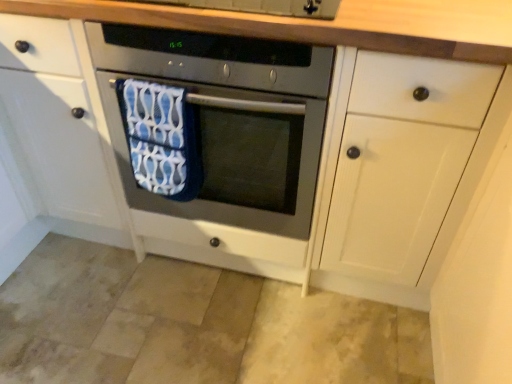
At what (x,y) coordinates should I click in order to perform the action: click on blue fabric beach towel at center. Please return your answer as a coordinate pair (x, y). This screenshot has width=512, height=384. Looking at the image, I should click on (162, 138).

What do you see at coordinates (162, 138) in the screenshot? I see `blue fabric beach towel at center` at bounding box center [162, 138].

Identify the location of satin silver oven at center. This screenshot has height=384, width=512. (226, 120).

Measure the distance between satin silver oven at center and camera.

satin silver oven at center and camera are 36.29 inches apart.

In order to face satin silver oven at center, should I rotate leftwards or rightwards?

Rotate left and turn 2.838 degrees.

Image resolution: width=512 pixels, height=384 pixels. What do you see at coordinates (226, 120) in the screenshot?
I see `satin silver oven at center` at bounding box center [226, 120].

Where is `blue fabric beach towel at center`? blue fabric beach towel at center is located at coordinates (162, 138).

Which is more to the left, blue fabric beach towel at center or satin silver oven at center?

blue fabric beach towel at center.

Consider the image. Who is more distant, blue fabric beach towel at center or satin silver oven at center?

blue fabric beach towel at center is further from the camera.

Which point is more forward, (165, 135) or (312, 81)?

Positioned in front is point (312, 81).

From the image's perspective, between blue fabric beach towel at center and satin silver oven at center, who is located below?

blue fabric beach towel at center is shown below in the image.

From a real-world perspective, which object stands above the other?

blue fabric beach towel at center, from a real-world perspective.

Can you confirm if blue fabric beach towel at center is wider than satin silver oven at center?

No.

Which of these two, blue fabric beach towel at center or satin silver oven at center, stands taller?

With more height is satin silver oven at center.

Between blue fabric beach towel at center and satin silver oven at center, which one has smaller size?

blue fabric beach towel at center.

Is blue fabric beach towel at center located outside satin silver oven at center?

Actually, blue fabric beach towel at center is within satin silver oven at center.

Consider the image. Are blue fabric beach towel at center and satin silver oven at center far apart?

They are positioned close to each other.

Could you tell me if blue fabric beach towel at center is turned towards satin silver oven at center?

Yes, blue fabric beach towel at center is aimed at satin silver oven at center.

How many degrees apart are the facing directions of blue fabric beach towel at center and satin silver oven at center?

The facing directions of blue fabric beach towel at center and satin silver oven at center are 3.1 degrees apart.

The image size is (512, 384). In order to click on oven on the right of blue fabric beach towel at center in this screenshot , I will do `click(226, 120)`.

Consider the image. Between satin silver oven at center and blue fabric beach towel at center, which one appears on the right side from the viewer's perspective?

satin silver oven at center is more to the right.

Is the position of satin silver oven at center less distant than that of blue fabric beach towel at center?

Yes, it is.

Is point (90, 43) closer or farther from the camera than point (140, 98)?

Point (90, 43) appears to be closer to the viewer than point (140, 98).

From the image's perspective, which object appears higher, satin silver oven at center or blue fabric beach towel at center?

satin silver oven at center appears higher in the image.

From a real-world perspective, is satin silver oven at center above or below blue fabric beach towel at center?

From a real-world perspective, satin silver oven at center is physically below blue fabric beach towel at center.

In terms of width, does satin silver oven at center look wider or thinner when compared to blue fabric beach towel at center?

In the image, satin silver oven at center appears to be wider than blue fabric beach towel at center.

Can you confirm if satin silver oven at center is shorter than blue fabric beach towel at center?

In fact, satin silver oven at center may be taller than blue fabric beach towel at center.

Does satin silver oven at center have a larger size compared to blue fabric beach towel at center?

Correct, satin silver oven at center is larger in size than blue fabric beach towel at center.

Choose the correct answer: Is satin silver oven at center inside blue fabric beach towel at center or outside it?

satin silver oven at center is not enclosed by blue fabric beach towel at center.

Is satin silver oven at center next to blue fabric beach towel at center and touching it?

No, satin silver oven at center is not next to blue fabric beach towel at center.

Does satin silver oven at center turn towards blue fabric beach towel at center?

Yes, satin silver oven at center is turned towards blue fabric beach towel at center.

How many degrees apart are the facing directions of satin silver oven at center and blue fabric beach towel at center?

The angular difference between satin silver oven at center and blue fabric beach towel at center is 3.1 degrees.

Locate an element on the screen. The image size is (512, 384). oven below the blue fabric beach towel at center (from a real-world perspective) is located at coordinates (226, 120).

Identify the location of oven that appears above the blue fabric beach towel at center (from the image's perspective). The height and width of the screenshot is (384, 512). (226, 120).

You are a GUI agent. You are given a task and a screenshot of the screen. Output one action in this format:
    pyautogui.click(x=<x>, y=<y>)
    Task: Click on the oven below the blue fabric beach towel at center (from a real-world perspective)
    The width and height of the screenshot is (512, 384).
    Given the screenshot: What is the action you would take?
    pyautogui.click(x=226, y=120)